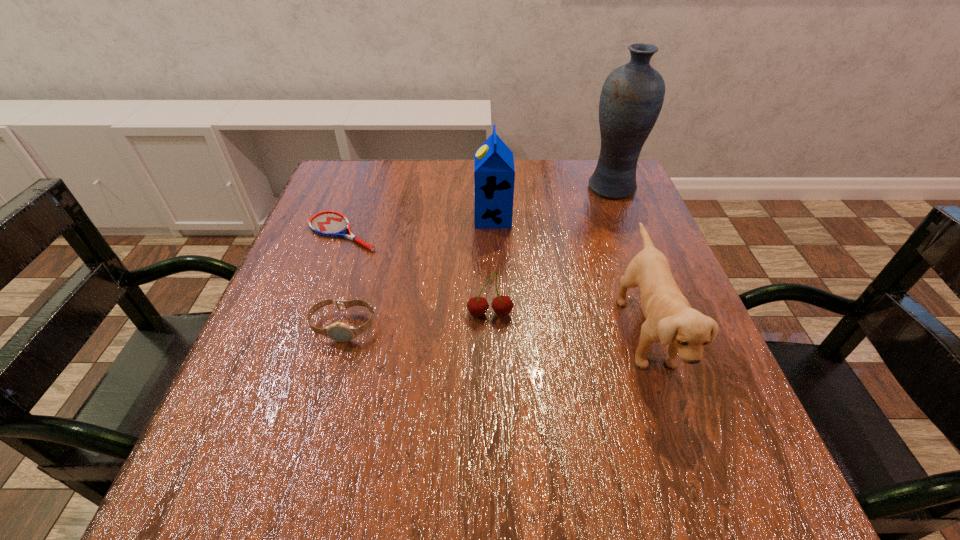
Locate an element on the screen. The width and height of the screenshot is (960, 540). vacant space that satisfies the following two spatial constraints: 1. with the cap open on the second tallest object; 2. on the surface of the cherry is located at coordinates (496, 314).

In order to click on free location that satisfies the following two spatial constraints: 1. with the cap open on the fifth shortest object; 2. on the surface of the cherry in this screenshot , I will do `click(496, 314)`.

Find the location of a particular element. vacant space that satisfies the following two spatial constraints: 1. with the cap open on the carton; 2. on the surface of the cherry is located at coordinates (496, 314).